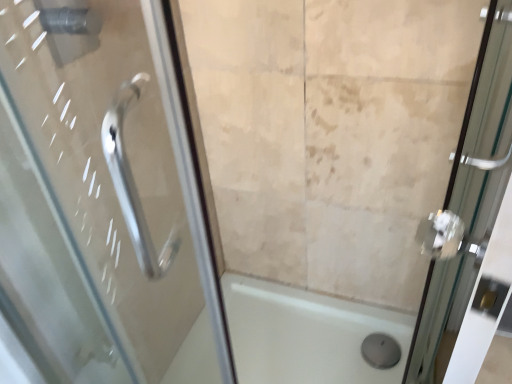
Question: Is clear glass door at right surrounding white glossy bath at center?

Choices:
 (A) no
 (B) yes

Answer: (A)

Question: Is clear glass door at right at the right side of white glossy bath at center?

Choices:
 (A) no
 (B) yes

Answer: (B)

Question: Is clear glass door at right directly adjacent to white glossy bath at center?

Choices:
 (A) no
 (B) yes

Answer: (A)

Question: Are clear glass door at right and white glossy bath at center located far from each other?

Choices:
 (A) no
 (B) yes

Answer: (A)

Question: Is clear glass door at right closer to camera compared to white glossy bath at center?

Choices:
 (A) yes
 (B) no

Answer: (A)

Question: Is clear glass door at right positioned beyond the bounds of white glossy bath at center?

Choices:
 (A) yes
 (B) no

Answer: (A)

Question: Does white glossy bath at center come in front of clear glass door at right?

Choices:
 (A) no
 (B) yes

Answer: (A)

Question: Does white glossy bath at center have a larger size compared to clear glass door at right?

Choices:
 (A) yes
 (B) no

Answer: (B)

Question: From the image's perspective, is white glossy bath at center over clear glass door at right?

Choices:
 (A) yes
 (B) no

Answer: (B)

Question: Does white glossy bath at center have a greater width compared to clear glass door at right?

Choices:
 (A) no
 (B) yes

Answer: (B)

Question: From a real-world perspective, is white glossy bath at center physically below clear glass door at right?

Choices:
 (A) no
 (B) yes

Answer: (B)

Question: Does white glossy bath at center have a greater height compared to clear glass door at right?

Choices:
 (A) no
 (B) yes

Answer: (A)

Question: Is white glossy bath at center inside or outside of clear glass door at right?

Choices:
 (A) inside
 (B) outside

Answer: (B)